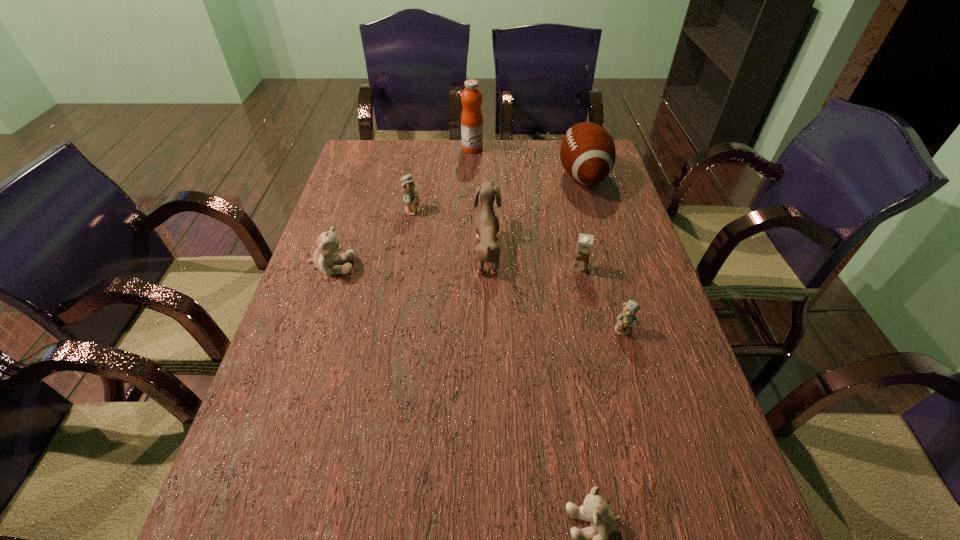
The image size is (960, 540). Identify the location of orange fruit juice. (471, 119).

At what (x,y) coordinates should I click in order to perform the action: click on the tallest object. Please return your answer as a coordinate pair (x, y). Looking at the image, I should click on (471, 119).

Where is `football`? football is located at coordinates (587, 153).

What are the coordinates of `puppy` in the screenshot? It's located at (487, 225).

In order to click on the second object from left to right in this screenshot , I will do `click(411, 198)`.

Identify the location of the third teddy bear from right to left. The width and height of the screenshot is (960, 540). coord(411,198).

Locate an element on the screen. the left gray teddy bear is located at coordinates (324, 259).

Where is `the bigger gray teddy bear`? This screenshot has width=960, height=540. the bigger gray teddy bear is located at coordinates (324, 259).

Where is `chocolate milk`? This screenshot has height=540, width=960. chocolate milk is located at coordinates (585, 242).

You are a GUI agent. You are given a task and a screenshot of the screen. Output one action in this format:
    pyautogui.click(x=<x>, y=<y>)
    Task: Click on the right blue teddy bear
    The image size is (960, 540).
    Given the screenshot: What is the action you would take?
    pyautogui.click(x=627, y=319)